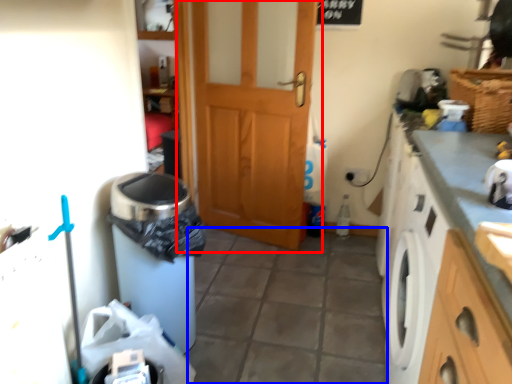
Question: Which object appears closest to the camera in this image, door (highlighted by a red box) or tile (highlighted by a blue box)?

Choices:
 (A) door
 (B) tile

Answer: (B)